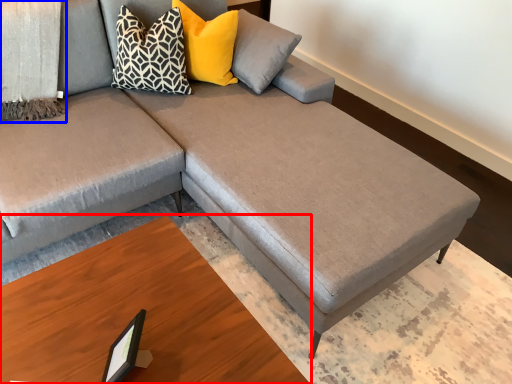
Question: Among these objects, which one is farthest to the camera, table (highlighted by a red box) or blanket (highlighted by a blue box)?

Choices:
 (A) table
 (B) blanket

Answer: (B)